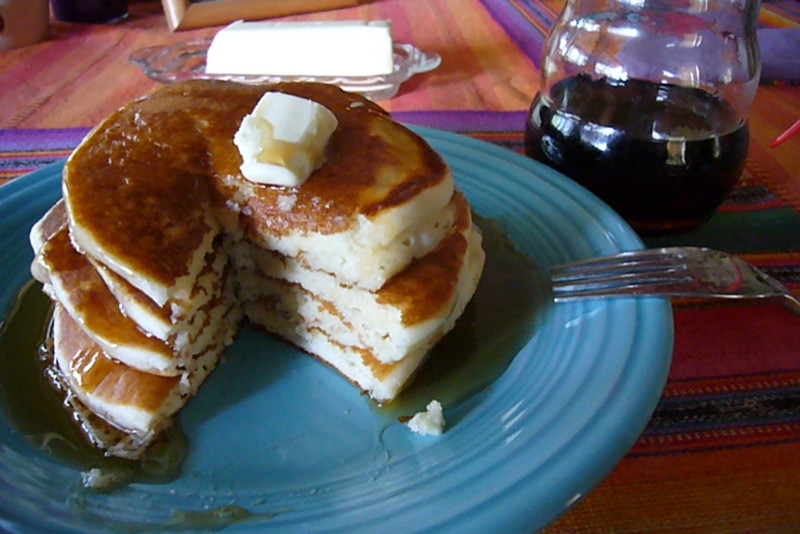
I want to click on table, so click(718, 421).